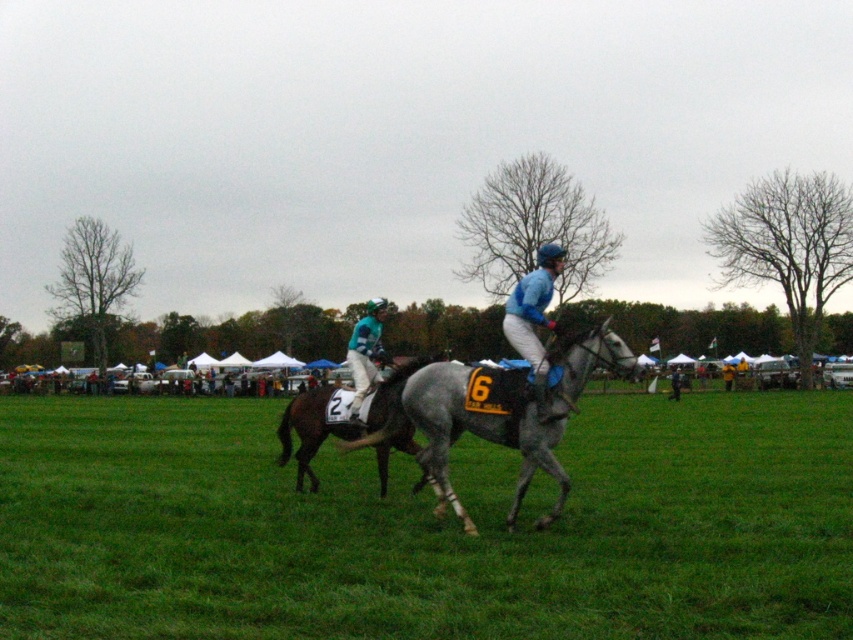
Question: Can you confirm if dark brown glossy horse at center is wider than teal jersey at center?

Choices:
 (A) yes
 (B) no

Answer: (A)

Question: Estimate the real-world distances between objects in this image. Which object is farther from the yellow fabric umbrella at center?

Choices:
 (A) teal jersey at center
 (B) gray textured horse at center
 (C) dark brown glossy horse at center

Answer: (C)

Question: Does teal jersey at center lie behind yellow fabric umbrella at center?

Choices:
 (A) yes
 (B) no

Answer: (B)

Question: Which object is the closest to the yellow fabric umbrella at center?

Choices:
 (A) gray textured horse at center
 (B) dark brown glossy horse at center

Answer: (A)

Question: Which point is closer to the camera taking this photo?

Choices:
 (A) (297, 627)
 (B) (727, 380)

Answer: (A)

Question: Can you confirm if gray glossy horse at center is wider than yellow fabric umbrella at center?

Choices:
 (A) yes
 (B) no

Answer: (B)